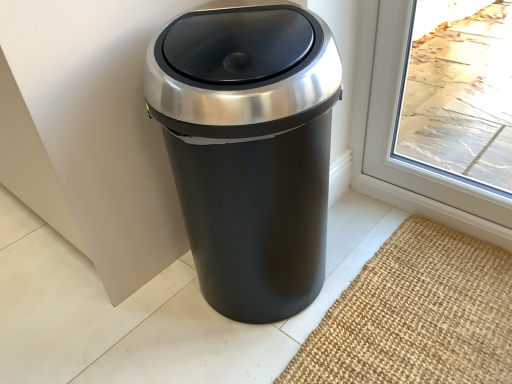
Locate an element on the screen. This screenshot has width=512, height=384. vacant area that lies to the right of matte black trash can at center is located at coordinates (394, 278).